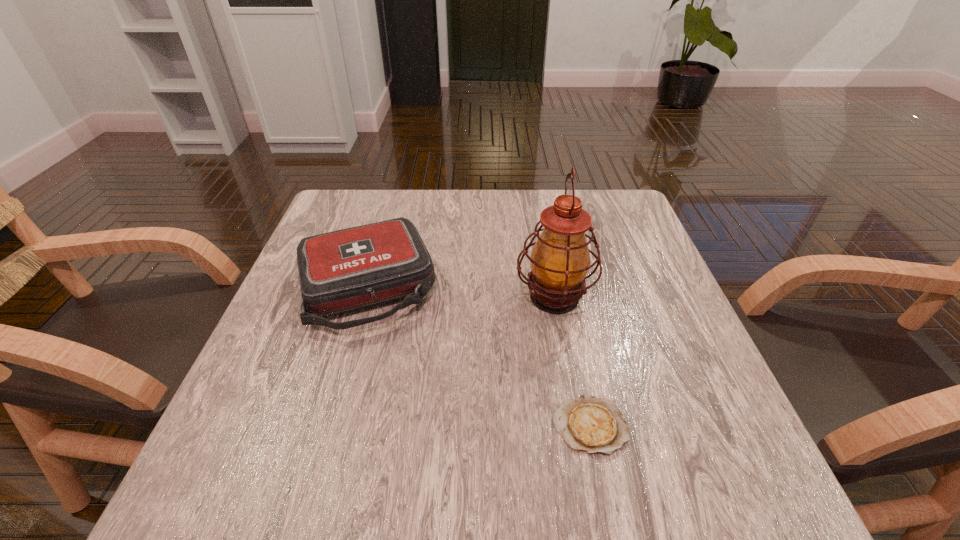
Where is `free point that satisfies the following two spatial constraints: 1. on the front side of the second tallest object; 2. on the left side of the tallest object`? The width and height of the screenshot is (960, 540). free point that satisfies the following two spatial constraints: 1. on the front side of the second tallest object; 2. on the left side of the tallest object is located at coordinates (364, 297).

Identify the location of blank space that satisfies the following two spatial constraints: 1. on the front side of the oil lamp; 2. on the left side of the nearest object. (578, 426).